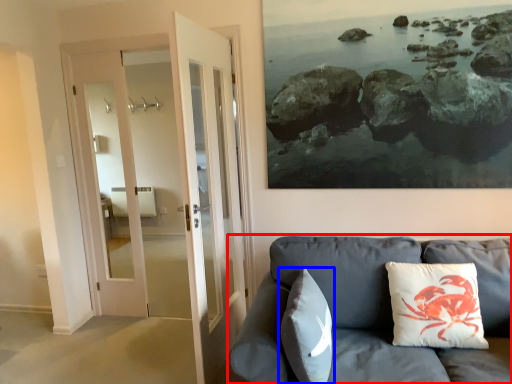
Question: Which of the following is the closest to the observer, studio couch (highlighted by a red box) or pillow (highlighted by a blue box)?

Choices:
 (A) studio couch
 (B) pillow

Answer: (A)